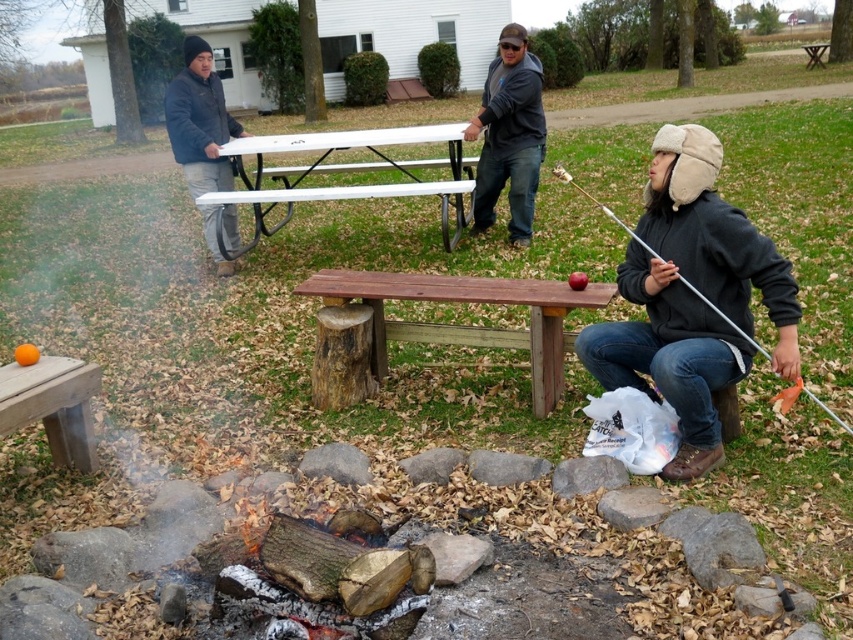
Describe the element at coordinates (343, 172) in the screenshot. The image size is (853, 640). I see `white painted wood picnic table at upper center` at that location.

Does white painted wood picnic table at upper center have a larger size compared to dark gray hoodie at center?

Correct, white painted wood picnic table at upper center is larger in size than dark gray hoodie at center.

This screenshot has height=640, width=853. In order to click on white painted wood picnic table at upper center in this screenshot , I will do `click(343, 172)`.

The width and height of the screenshot is (853, 640). Find the location of `white painted wood picnic table at upper center`. white painted wood picnic table at upper center is located at coordinates (343, 172).

From the picture: Who is positioned more to the left, dark gray hoodie at center or dark gray jacket at left?

From the viewer's perspective, dark gray jacket at left appears more on the left side.

Can you confirm if dark gray hoodie at center is positioned to the right of dark gray jacket at left?

Yes, dark gray hoodie at center is to the right of dark gray jacket at left.

Between point (521, 148) and point (231, 172), which one is positioned behind?

Positioned behind is point (231, 172).

Where is `dark gray hoodie at center`? The width and height of the screenshot is (853, 640). dark gray hoodie at center is located at coordinates coord(509,134).

You are a GUI agent. You are given a task and a screenshot of the screen. Output one action in this format:
    pyautogui.click(x=<x>, y=<y>)
    Task: Click on the dark gray jacket at left
    
    Given the screenshot: What is the action you would take?
    [199, 122]

Does dark gray jacket at left appear under metallic silver fishing pole at lower right?

No.

Which is in front, point (209, 115) or point (833, 413)?

Point (833, 413) is in front.

Find the location of a particular element. The height and width of the screenshot is (640, 853). dark gray jacket at left is located at coordinates (199, 122).